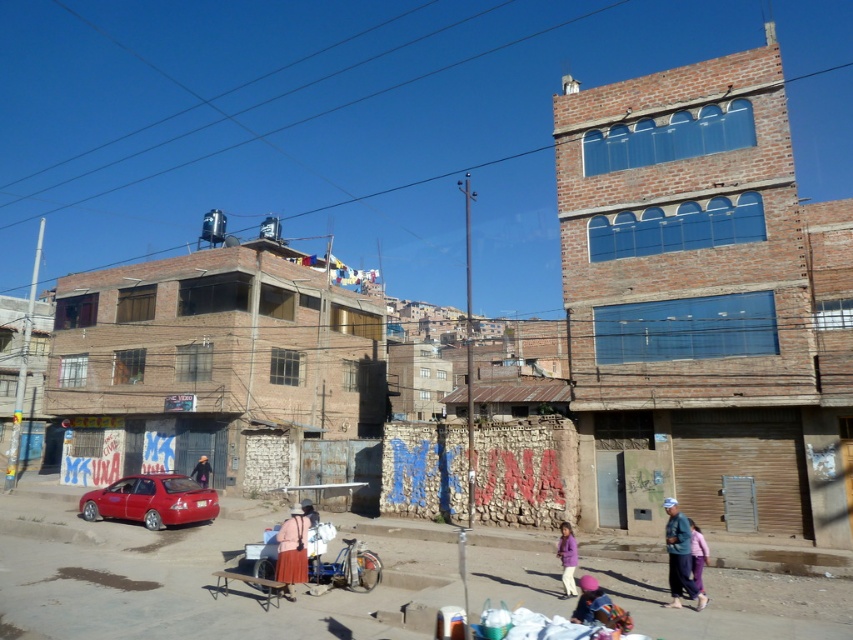
You are a pedestrian standing on the street and want to take a photo of the metallic red car at lower left and the purple fabric pants at lower right. Which object should you focus on first to ensure both are in the frame?

You should focus on the metallic red car at lower left first because it is closer to you than the purple fabric pants at lower right, so adjusting the camera to include it will also likely capture the farther object in the frame.

You are a delivery person trying to navigate through the street. You see the metallic red car at lower left and the purple fabric pants at lower right. Which object is wider?

The metallic red car at lower left is wider than the purple fabric pants at lower right according to the description.

You are standing at the center of the street and want to reach a point closer to you. Which point should you head towards, point (699, 536) or point (209, 470)?

Point (699, 536) is closer to the viewer than point (209, 470), so you should head towards point (699, 536).